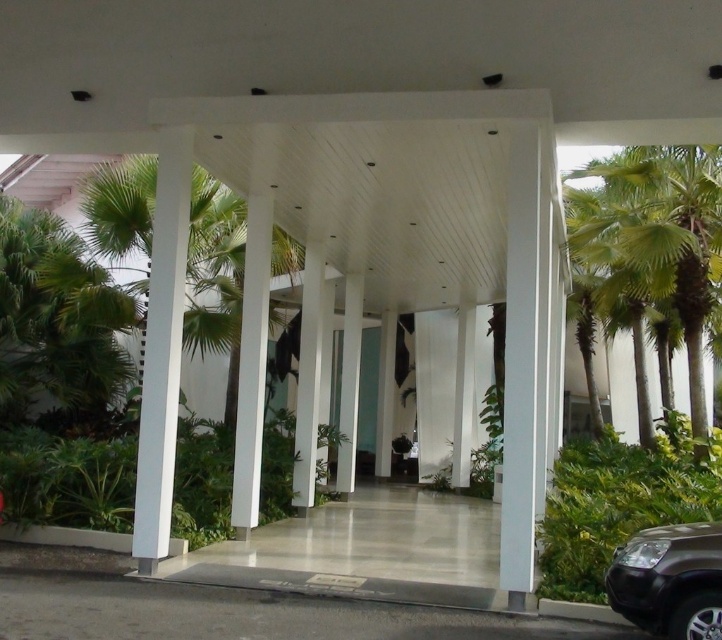
You are standing at the entrance of the walkway and want to find the green leafy palm tree at right. What is the coordinate of its position?

The coordinate of the green leafy palm tree at right is at point (656, 241).

You are standing at the center of the walkway and want to locate the green leafy palm tree at right. What are the coordinates of its position?

The green leafy palm tree at right is located at coordinates point (x=656, y=241).